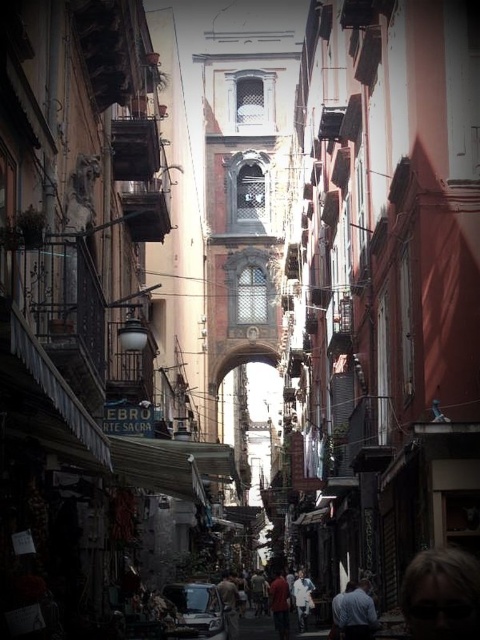
Between matte red shirt at center and white cotton shirt at center, which one appears on the left side from the viewer's perspective?

From the viewer's perspective, matte red shirt at center appears more on the left side.

This screenshot has width=480, height=640. Describe the element at coordinates (279, 604) in the screenshot. I see `matte red shirt at center` at that location.

I want to click on matte red shirt at center, so click(279, 604).

Does blue fabric shirt at lower right lie in front of matte red shirt at center?

Yes, blue fabric shirt at lower right is in front of matte red shirt at center.

Can you confirm if blue fabric shirt at lower right is positioned to the left of matte red shirt at center?

No, blue fabric shirt at lower right is not to the left of matte red shirt at center.

Is point (350, 616) positioned in front of point (276, 600)?

Yes.

You are a GUI agent. You are given a task and a screenshot of the screen. Output one action in this format:
    pyautogui.click(x=<x>, y=<y>)
    Task: Click on the blue fabric shirt at lower right
    This screenshot has height=640, width=480.
    Given the screenshot: What is the action you would take?
    pyautogui.click(x=357, y=612)

Can you confirm if blue fabric shirt at lower right is thinner than white cotton shirt at center?

In fact, blue fabric shirt at lower right might be wider than white cotton shirt at center.

Identify the location of blue fabric shirt at lower right. (357, 612).